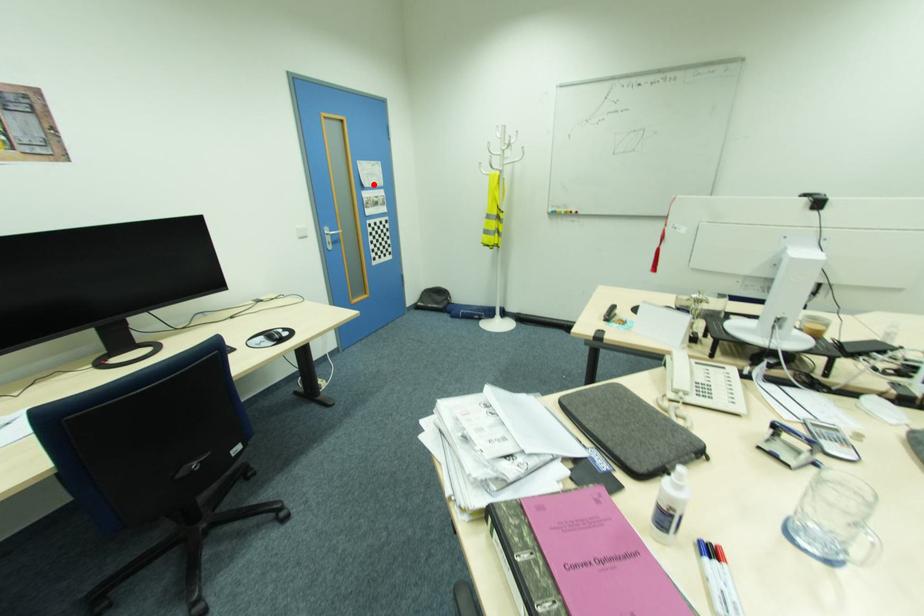
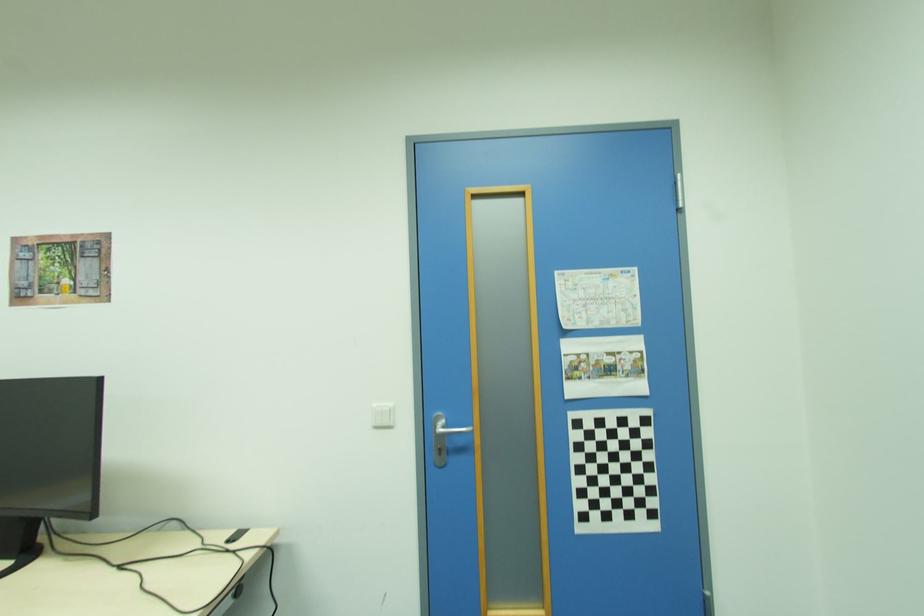
Question: I am providing you with two images of the same scene from different viewpoints. In image1, a red point is highlighted. Considering the same 3D point in image2, which of the following is correct?

Choices:
 (A) It is closer
 (B) It is farther

Answer: (B)